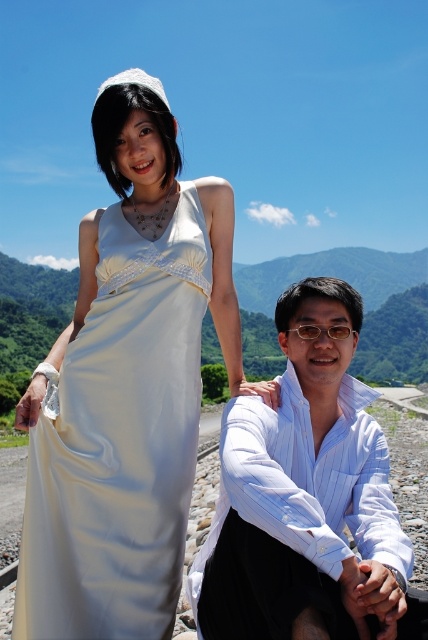
Based on the photo, who is taller, satin white dress at center or white striped shirt at center?

Standing taller between the two is satin white dress at center.

Is satin white dress at center wider than white striped shirt at center?

No, satin white dress at center is not wider than white striped shirt at center.

Between point (56, 589) and point (299, 566), which one is positioned in front?

Point (299, 566) is in front.

This screenshot has width=428, height=640. Identify the location of satin white dress at center. (118, 442).